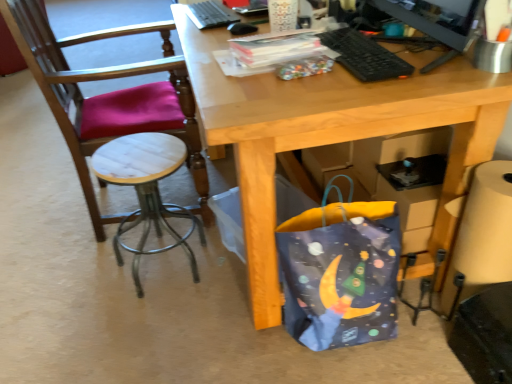
Identify the location of free space in front of white marble stool at left. (147, 334).